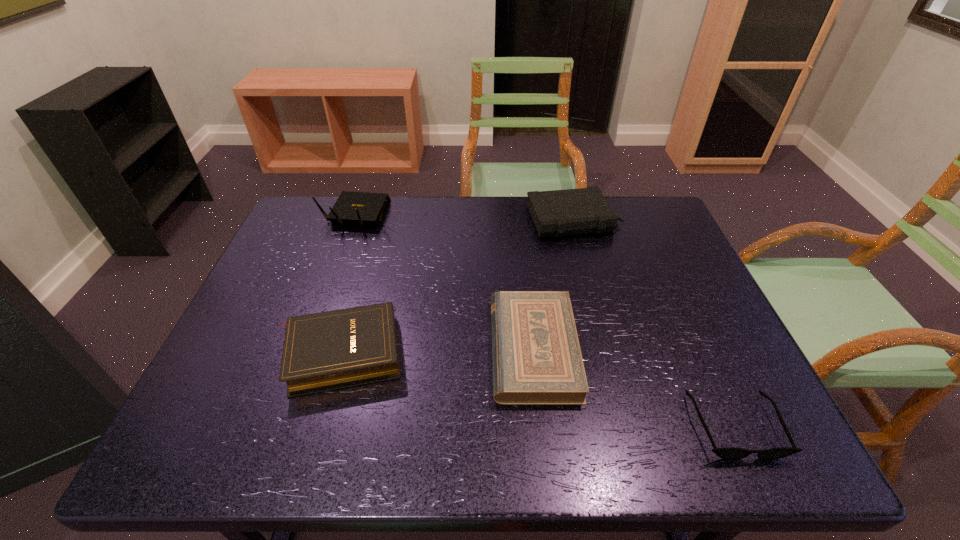
You are a GUI agent. You are given a task and a screenshot of the screen. Output one action in this format:
    pyautogui.click(x=<x>, y=<y>)
    Task: Click on the object situated at the near right corner
    
    Given the screenshot: What is the action you would take?
    pyautogui.click(x=729, y=453)

Identify the location of free spot at the far edge of the desktop. The height and width of the screenshot is (540, 960). (449, 221).

Where is `free region at the near edge of the desktop`? This screenshot has height=540, width=960. free region at the near edge of the desktop is located at coordinates (698, 458).

The width and height of the screenshot is (960, 540). In the image, there is a desktop. In order to click on vacant space at the left edge in this screenshot , I will do click(314, 286).

The image size is (960, 540). In order to click on vacant area at the right edge in this screenshot , I will do `click(735, 392)`.

Locate an element on the screen. free space at the far right corner of the desktop is located at coordinates (661, 218).

This screenshot has height=540, width=960. I want to click on free spot between the router and the shortest Bible, so click(445, 282).

Locate an element on the screen. The height and width of the screenshot is (540, 960). vacant area between the farthest Bible and the sunglasses is located at coordinates (655, 323).

Where is `vacant space that's between the leftmost Bible and the farthest Bible`? The height and width of the screenshot is (540, 960). vacant space that's between the leftmost Bible and the farthest Bible is located at coordinates (457, 286).

Identify the location of free point between the farthest Bible and the leftmost Bible. The image size is (960, 540). (457, 286).